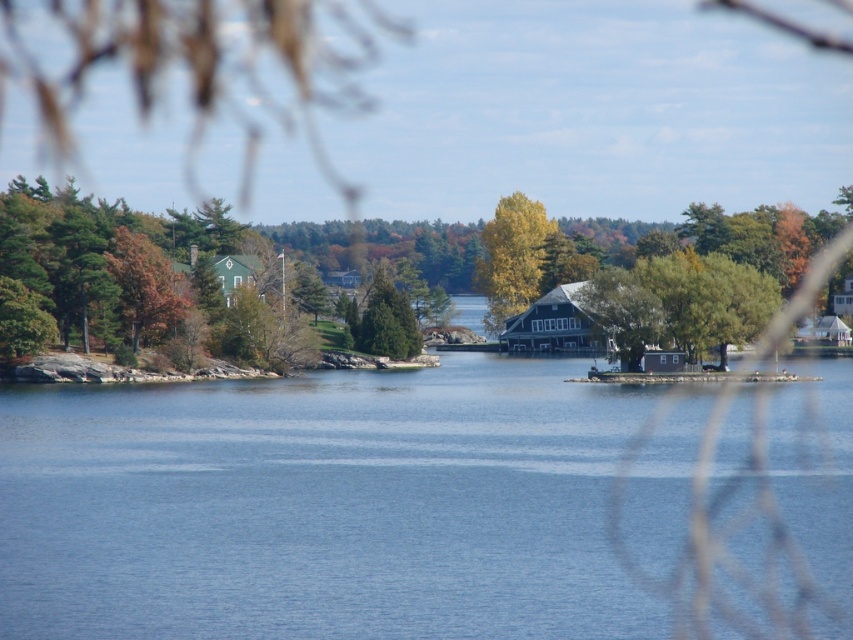
Question: Is blue water at center above green matte tree at left?

Choices:
 (A) yes
 (B) no

Answer: (B)

Question: Does blue water at center appear on the left side of green matte tree at left?

Choices:
 (A) no
 (B) yes

Answer: (A)

Question: Based on their relative distances, which object is nearer to the green matte tree at left?

Choices:
 (A) yellow-green foliage at center
 (B) blue water at center

Answer: (A)

Question: Which of the following is the farthest from the observer?

Choices:
 (A) blue water at center
 (B) yellow-green foliage at center

Answer: (B)

Question: Estimate the real-world distances between objects in this image. Which object is closer to the yellow-green foliage at center?

Choices:
 (A) green matte tree at left
 (B) blue water at center

Answer: (A)

Question: Does green matte tree at left have a greater width compared to yellow-green foliage at center?

Choices:
 (A) no
 (B) yes

Answer: (B)